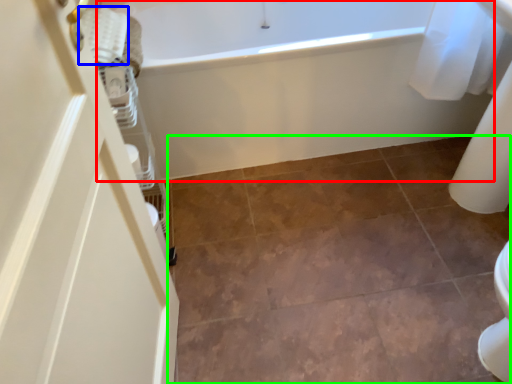
Question: Which object is positioned closest to bathtub (highlighted by a red box)? Select from material (highlighted by a blue box) and ceramic tile (highlighted by a green box).

Choices:
 (A) material
 (B) ceramic tile

Answer: (B)